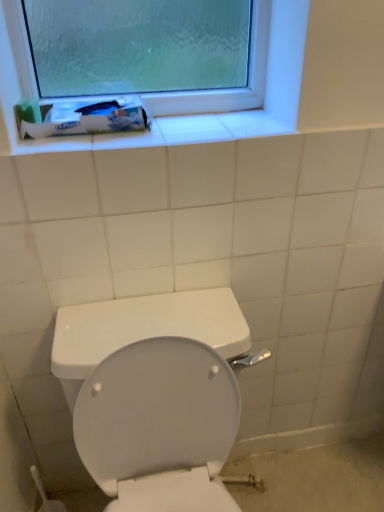
Question: Is white glossy toilet at center further to camera compared to white matte tube at upper left?

Choices:
 (A) yes
 (B) no

Answer: (B)

Question: Can we say white glossy toilet at center lies outside white matte tube at upper left?

Choices:
 (A) no
 (B) yes

Answer: (B)

Question: Is there a large distance between white glossy toilet at center and white matte tube at upper left?

Choices:
 (A) yes
 (B) no

Answer: (B)

Question: Could you tell me if white glossy toilet at center is facing white matte tube at upper left?

Choices:
 (A) yes
 (B) no

Answer: (B)

Question: Considering the relative sizes of white glossy toilet at center and white matte tube at upper left in the image provided, is white glossy toilet at center wider than white matte tube at upper left?

Choices:
 (A) yes
 (B) no

Answer: (A)

Question: From the image's perspective, is white glossy toilet at center located above white matte tube at upper left?

Choices:
 (A) yes
 (B) no

Answer: (B)

Question: Is white matte tube at upper left closer to the viewer compared to white glossy toilet at center?

Choices:
 (A) yes
 (B) no

Answer: (B)

Question: Is white matte tube at upper left in contact with white glossy toilet at center?

Choices:
 (A) yes
 (B) no

Answer: (B)

Question: Can you confirm if white matte tube at upper left is wider than white glossy toilet at center?

Choices:
 (A) yes
 (B) no

Answer: (B)

Question: Does white matte tube at upper left have a smaller size compared to white glossy toilet at center?

Choices:
 (A) no
 (B) yes

Answer: (B)

Question: Can you confirm if white matte tube at upper left is positioned to the left of white glossy toilet at center?

Choices:
 (A) no
 (B) yes

Answer: (B)

Question: Is white matte tube at upper left outside of white glossy toilet at center?

Choices:
 (A) yes
 (B) no

Answer: (A)

Question: Considering the positions of white glossy toilet at center and white matte tube at upper left in the image, is white glossy toilet at center wider or thinner than white matte tube at upper left?

Choices:
 (A) wide
 (B) thin

Answer: (A)